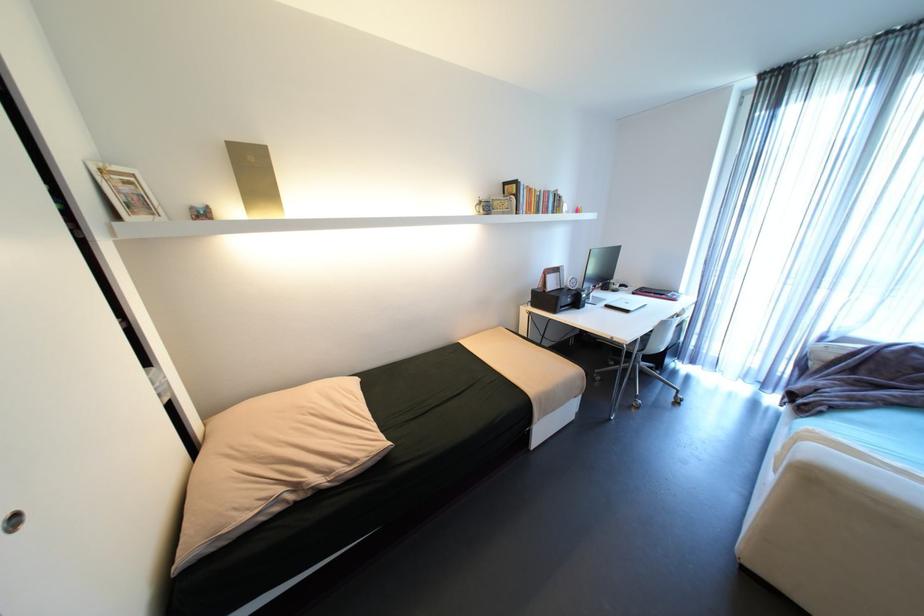
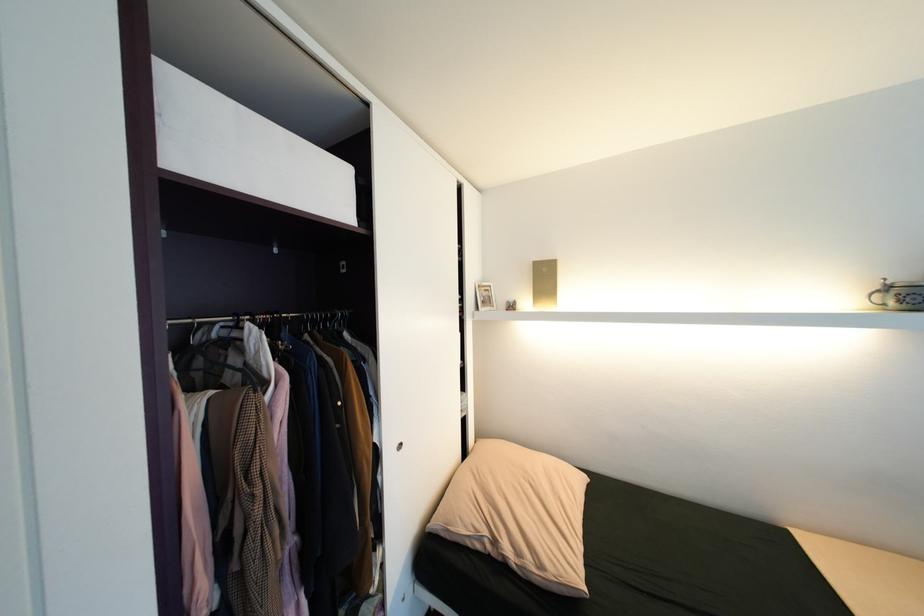
Question: The camera is either moving clockwise (left) or counter-clockwise (right) around the object. The first image is from the beginning of the video and the second image is from the end. Is the camera moving left or right when shooting the video?

Choices:
 (A) Left
 (B) Right

Answer: (B)